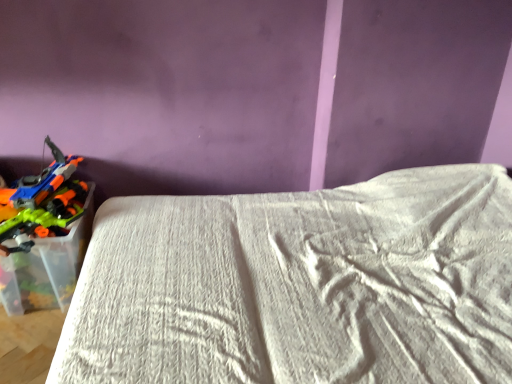
Where is `white textured bed at lower left`? This screenshot has width=512, height=384. white textured bed at lower left is located at coordinates (300, 285).

Image resolution: width=512 pixels, height=384 pixels. What do you see at coordinates (300, 285) in the screenshot?
I see `white textured bed at lower left` at bounding box center [300, 285].

This screenshot has width=512, height=384. Describe the element at coordinates (41, 201) in the screenshot. I see `translucent plastic toy guns at left` at that location.

Where is `translucent plastic toy guns at left`? This screenshot has height=384, width=512. translucent plastic toy guns at left is located at coordinates (41, 201).

Locate an element on the screen. Image resolution: width=512 pixels, height=384 pixels. white textured bed at lower left is located at coordinates (300, 285).

Which object is positioned more to the right, white textured bed at lower left or translucent plastic toy guns at left?

From the viewer's perspective, white textured bed at lower left appears more on the right side.

Considering their positions, is white textured bed at lower left located in front of or behind translucent plastic toy guns at left?

white textured bed at lower left is positioned closer to the viewer than translucent plastic toy guns at left.

Considering the points (278, 333) and (82, 159), which point is in front, point (278, 333) or point (82, 159)?

The point (278, 333) is closer to the camera.

From the image's perspective, relative to translucent plastic toy guns at left, is white textured bed at lower left above or below?

From the image's perspective, white textured bed at lower left appears below translucent plastic toy guns at left.

From a real-world perspective, between white textured bed at lower left and translucent plastic toy guns at left, who is vertically higher?

translucent plastic toy guns at left.

Is white textured bed at lower left wider than translucent plastic toy guns at left?

Indeed, white textured bed at lower left has a greater width compared to translucent plastic toy guns at left.

Which of these two, white textured bed at lower left or translucent plastic toy guns at left, stands shorter?

With less height is translucent plastic toy guns at left.

Considering the relative sizes of white textured bed at lower left and translucent plastic toy guns at left in the image provided, is white textured bed at lower left smaller than translucent plastic toy guns at left?

Actually, white textured bed at lower left might be larger than translucent plastic toy guns at left.

Which is correct: white textured bed at lower left is inside translucent plastic toy guns at left, or outside of it?

white textured bed at lower left exists outside the volume of translucent plastic toy guns at left.

Is white textured bed at lower left beside translucent plastic toy guns at left?

No, white textured bed at lower left is not in contact with translucent plastic toy guns at left.

Is white textured bed at lower left facing away from translucent plastic toy guns at left?

No, white textured bed at lower left's orientation is not away from translucent plastic toy guns at left.

What's the angular difference between white textured bed at lower left and translucent plastic toy guns at left's facing directions?

91.9 degrees separate the facing orientations of white textured bed at lower left and translucent plastic toy guns at left.

Identify the location of bed in front of the translucent plastic toy guns at left. (300, 285).

Would you say translucent plastic toy guns at left is to the left or to the right of white textured bed at lower left in the picture?

translucent plastic toy guns at left is positioned on white textured bed at lower left's left side.

Is translucent plastic toy guns at left in front of white textured bed at lower left?

No, translucent plastic toy guns at left is behind white textured bed at lower left.

Is point (20, 195) closer or farther from the camera than point (214, 269)?

Point (20, 195) appears to be farther away from the viewer than point (214, 269).

From the image's perspective, is translucent plastic toy guns at left located above or below white textured bed at lower left?

From the image's perspective, translucent plastic toy guns at left appears above white textured bed at lower left.

From a real-world perspective, is translucent plastic toy guns at left beneath white textured bed at lower left?

No, from a real-world perspective, translucent plastic toy guns at left is not beneath white textured bed at lower left.

Is translucent plastic toy guns at left wider than white textured bed at lower left?

No, translucent plastic toy guns at left is not wider than white textured bed at lower left.

Who is shorter, translucent plastic toy guns at left or white textured bed at lower left?

translucent plastic toy guns at left.

In terms of size, does translucent plastic toy guns at left appear bigger or smaller than white textured bed at lower left?

translucent plastic toy guns at left is smaller than white textured bed at lower left.

Is white textured bed at lower left completely or partially inside translucent plastic toy guns at left?

Actually, white textured bed at lower left is outside translucent plastic toy guns at left.

Would you consider translucent plastic toy guns at left to be distant from white textured bed at lower left?

No, translucent plastic toy guns at left is in close proximity to white textured bed at lower left.

Is translucent plastic toy guns at left facing away from white textured bed at lower left?

No, white textured bed at lower left is not at the back of translucent plastic toy guns at left.

Where is `bed on the right of translucent plastic toy guns at left`? The image size is (512, 384). bed on the right of translucent plastic toy guns at left is located at coordinates (300, 285).

At what (x,y) coordinates should I click in order to perform the action: click on bed on the right of translucent plastic toy guns at left. Please return your answer as a coordinate pair (x, y). Looking at the image, I should click on (300, 285).

I want to click on bed in front of the translucent plastic toy guns at left, so click(300, 285).